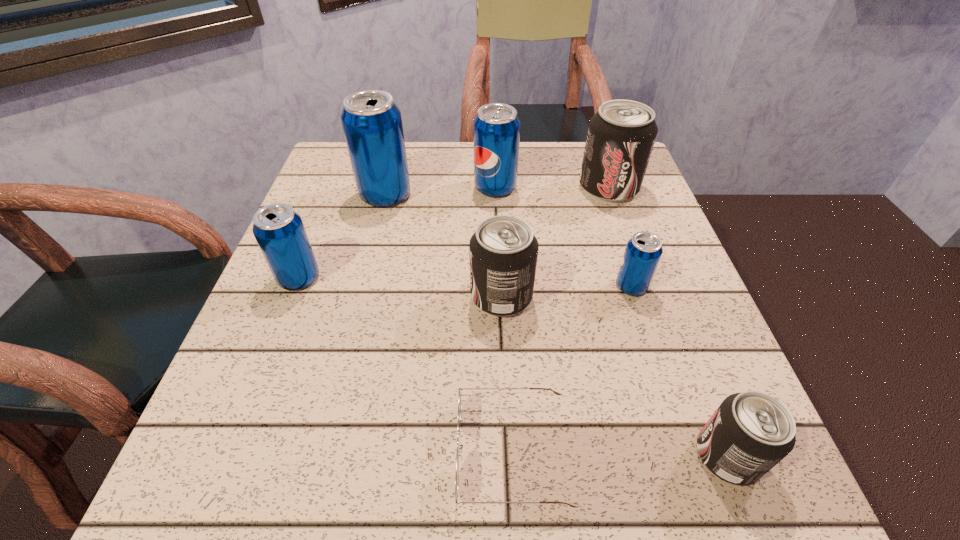
Find the location of a particular element. The height and width of the screenshot is (540, 960). the smallest black soda can is located at coordinates (750, 432).

The image size is (960, 540). Identify the location of green sunglasses. (459, 393).

At what (x,y) coordinates should I click in order to perform the action: click on the shortest object. Please return your answer as a coordinate pair (x, y). Looking at the image, I should click on (459, 393).

This screenshot has height=540, width=960. What are the coordinates of `blank area located on the front of the second soda can from left to right` in the screenshot? It's located at [373, 242].

Locate an element on the screen. blank space located on the left of the farthest black soda can is located at coordinates (447, 188).

Where is `vacant space located on the front of the second biggest blue pop soda`? vacant space located on the front of the second biggest blue pop soda is located at coordinates (498, 268).

Find the location of a particular element. The height and width of the screenshot is (540, 960). free space located on the right of the leftmost soda can is located at coordinates (483, 278).

This screenshot has width=960, height=540. Find the location of `vacant region located 0.140m on the right of the second farthest black soda can`. vacant region located 0.140m on the right of the second farthest black soda can is located at coordinates (607, 296).

This screenshot has height=540, width=960. I want to click on vacant region located 0.160m on the front of the rightmost blue pop soda, so click(660, 372).

You are a GUI agent. You are given a task and a screenshot of the screen. Output one action in this format:
    pyautogui.click(x=<x>, y=<y>)
    Task: Click on the free region located on the left of the nearest soda can
    
    Given the screenshot: What is the action you would take?
    pyautogui.click(x=660, y=456)